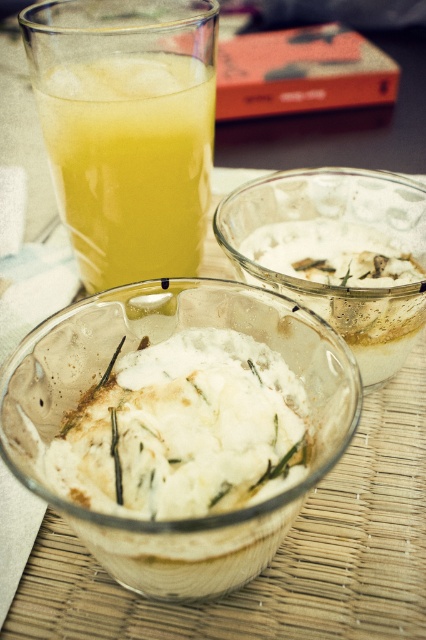
Who is lower down, white creamy ice cream at center or translucent yellow liquid at upper left?

Positioned lower is white creamy ice cream at center.

Is point (245, 422) behind point (164, 269)?

No, (245, 422) is closer to viewer.

This screenshot has height=640, width=426. Find the location of `white creamy ice cream at center`. white creamy ice cream at center is located at coordinates (184, 429).

The image size is (426, 640). What are the coordinates of `white creamy ice cream at center` in the screenshot? It's located at (184, 429).

Which is more to the left, translucent yellow liquid at upper left or white frosted glass bowl at center?

From the viewer's perspective, translucent yellow liquid at upper left appears more on the left side.

Can you confirm if translucent yellow liquid at upper left is wider than white frosted glass bowl at center?

No, translucent yellow liquid at upper left is not wider than white frosted glass bowl at center.

Locate an element on the screen. The image size is (426, 640). translucent yellow liquid at upper left is located at coordinates (131, 163).

Is white frosted bowl at center above translucent yellow liquid at upper left?

Actually, white frosted bowl at center is below translucent yellow liquid at upper left.

Is point (313, 372) closer to viewer compared to point (155, 237)?

Yes, it is.

Which is in front, point (218, 304) or point (160, 60)?

Point (218, 304) is in front.

The height and width of the screenshot is (640, 426). Find the location of `white frosted bowl at center`. white frosted bowl at center is located at coordinates (135, 349).